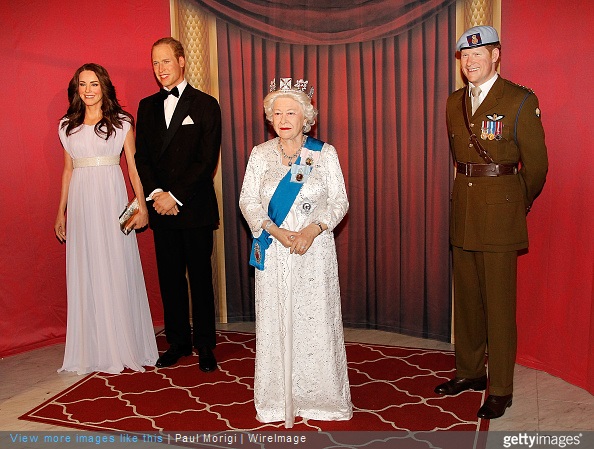
The width and height of the screenshot is (594, 449). Find the location of `red and tan rug`. red and tan rug is located at coordinates (182, 396).